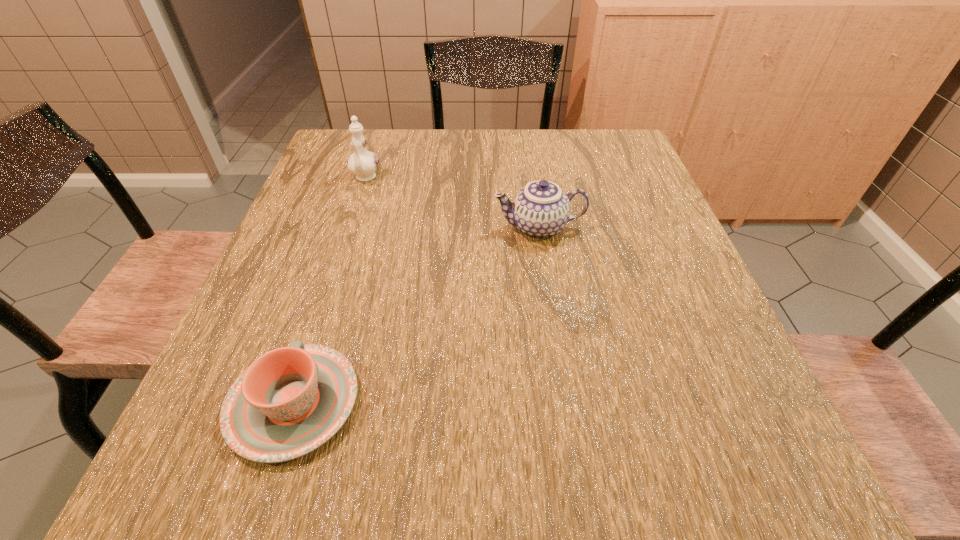
The image size is (960, 540). Find the location of `vacant space at the far left corner`. vacant space at the far left corner is located at coordinates (333, 165).

Where is `blank space at the far right corner`? This screenshot has height=540, width=960. blank space at the far right corner is located at coordinates (613, 156).

This screenshot has height=540, width=960. Find the location of `free spot between the second shortest chinaware and the tallest object`. free spot between the second shortest chinaware and the tallest object is located at coordinates (452, 203).

Identify the location of unoccupied position between the shortest chinaware and the farthest chinaware. (329, 291).

At what (x,y) coordinates should I click in order to perform the action: click on free space between the second tallest chinaware and the tallest object. Please return your answer as a coordinate pair (x, y). Looking at the image, I should click on (452, 203).

The width and height of the screenshot is (960, 540). Identify the location of vacant area between the tallest chinaware and the second shortest chinaware. (x=452, y=203).

Locate an element on the screen. Image resolution: width=960 pixels, height=540 pixels. vacant area that lies between the rightmost object and the nearest object is located at coordinates coord(417,315).

Where is `free space between the farthest chinaware and the shortest object`? This screenshot has width=960, height=540. free space between the farthest chinaware and the shortest object is located at coordinates (329, 291).

Where is `free space between the second tallest chinaware and the farthest object`? The height and width of the screenshot is (540, 960). free space between the second tallest chinaware and the farthest object is located at coordinates pos(452,203).

Identify the location of vacant space in between the nearest object and the farthest object. (329, 291).